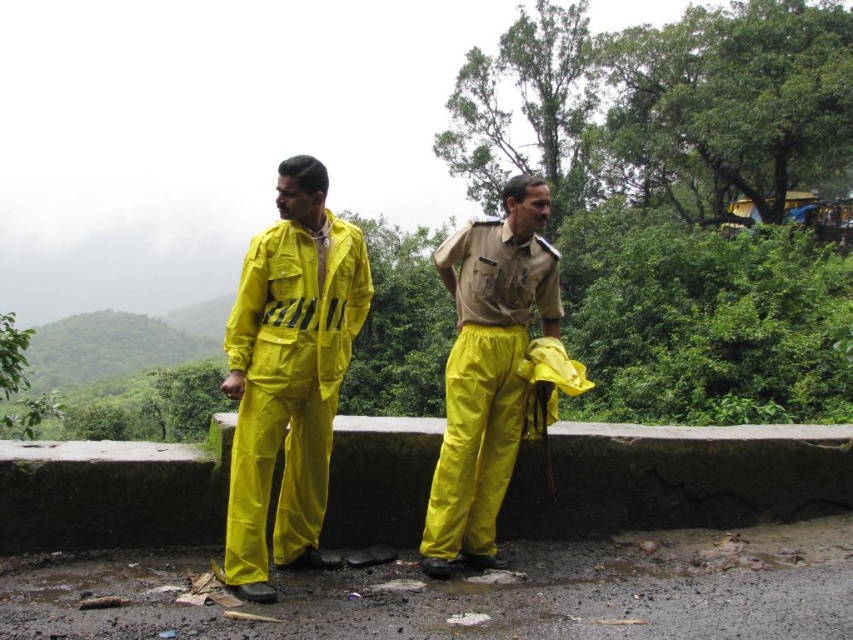
Who is shorter, rubberized yellow jumpsuit at center or yellow matte raincoat at center?

With less height is yellow matte raincoat at center.

Find the location of a particular element. rubberized yellow jumpsuit at center is located at coordinates (289, 374).

Who is positioned more to the left, rubberized yellow jumpsuit at center or yellow matte pants at center?

rubberized yellow jumpsuit at center is more to the left.

Can you confirm if rubberized yellow jumpsuit at center is wider than yellow matte pants at center?

No, rubberized yellow jumpsuit at center is not wider than yellow matte pants at center.

Is point (444, 260) behind point (503, 333)?

Yes, point (444, 260) is farther from viewer.

Locate an element on the screen. rubberized yellow jumpsuit at center is located at coordinates coord(289,374).

Can you confirm if yellow matte raincoat at center is positioned below yellow matte pants at center?

Actually, yellow matte raincoat at center is above yellow matte pants at center.

Who is more distant from viewer, (230,320) or (496,497)?

The point (496,497) is behind.

At what (x,y) coordinates should I click in order to perform the action: click on yellow matte raincoat at center. Please return your answer as a coordinate pair (x, y). Looking at the image, I should click on (288, 384).

At what (x,y) coordinates should I click in order to perform the action: click on yellow matte raincoat at center. Please return your answer as a coordinate pair (x, y). Looking at the image, I should click on (288, 384).